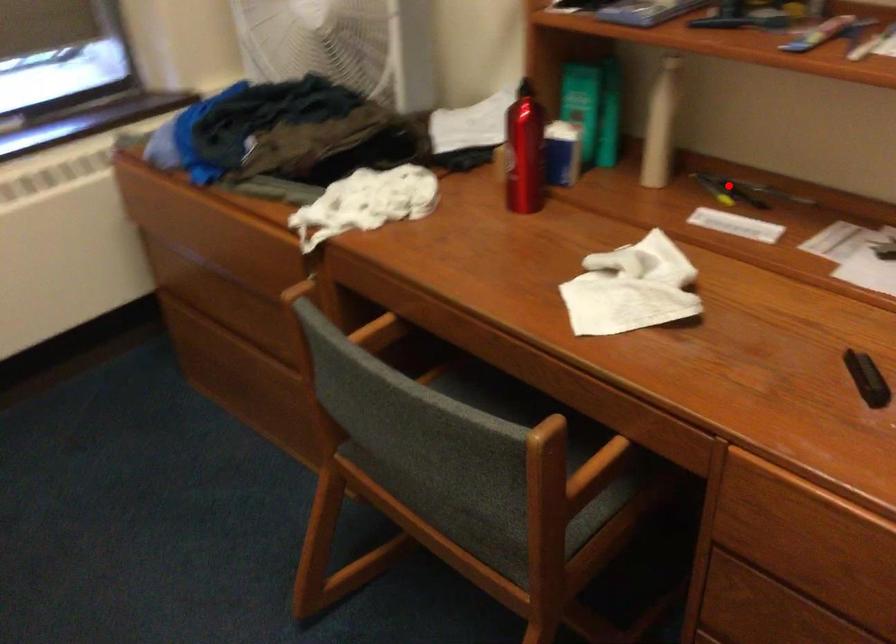
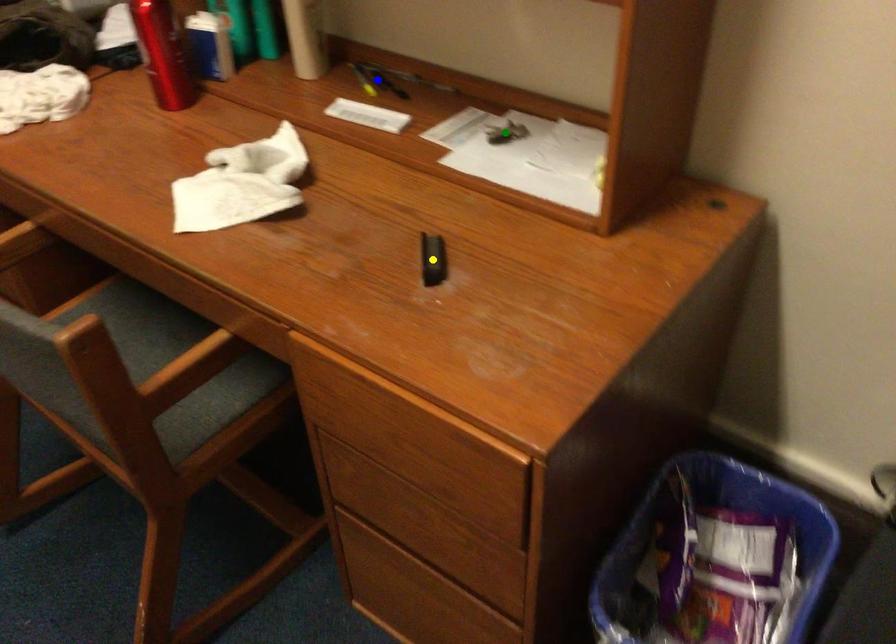
Question: I am providing you with two images of the same scene from different viewpoints. A red point is marked on the first image. You are given multiple points on the second image. Which point in image 2 is actually the same real-world point as the red point in image 1?

Choices:
 (A) green point
 (B) blue point
 (C) yellow point

Answer: (B)